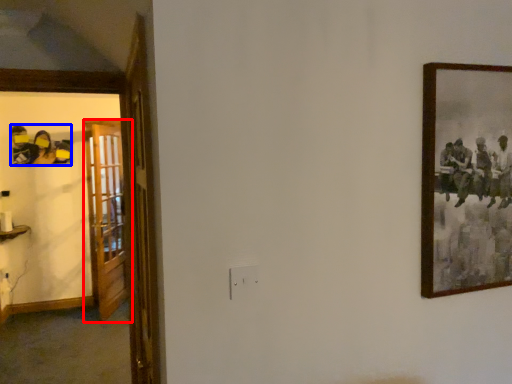
Question: Which object is closer to the camera taking this photo, door (highlighted by a red box) or art (highlighted by a blue box)?

Choices:
 (A) door
 (B) art

Answer: (A)